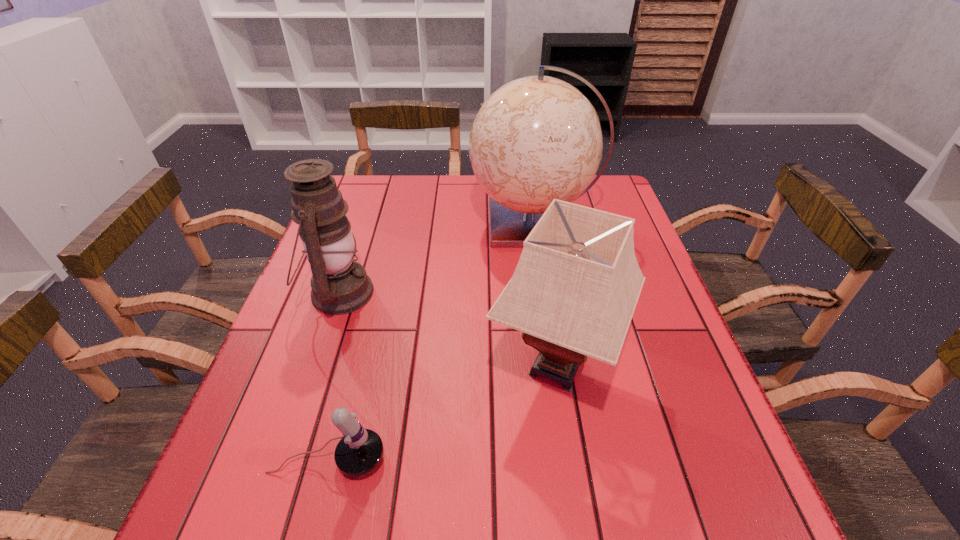
Image resolution: width=960 pixels, height=540 pixels. Identify the location of vacant region between the oil lamp and the tallest object. (436, 259).

Find the location of `object that is the third closest to the oil lamp`. object that is the third closest to the oil lamp is located at coordinates (573, 293).

Point out which object is positioned as the second nearest to the oil lamp. Please provide its 2D coordinates. Your answer should be formatted as a tuple, i.e. [(x, y)], where the tuple contains the x and y coordinates of a point satisfying the conditions above.

[(360, 450)]

You are a GUI agent. You are given a task and a screenshot of the screen. Output one action in this format:
    pyautogui.click(x=<x>, y=<y>)
    Task: Click on the free space that satisfies the following two spatial constraints: 1. on the surface of the tallest object showing Europe and Africa; 2. on the front side of the oil lamp
    
    Given the screenshot: What is the action you would take?
    pyautogui.click(x=543, y=293)

Where is `free location that satisfies the following two spatial constraints: 1. on the surface of the farthest object showing Europe and Africa; 2. on the back side of the lampshade`? The image size is (960, 540). free location that satisfies the following two spatial constraints: 1. on the surface of the farthest object showing Europe and Africa; 2. on the back side of the lampshade is located at coordinates (555, 367).

Identify the location of vacant point that satisfies the following two spatial constraints: 1. on the back side of the lampshade; 2. on the surface of the farthest object showing Europe and Africa. (534, 224).

Identify the location of free space in the image that satisfies the following two spatial constraints: 1. on the surface of the lampshade showing Europe and Africa; 2. on the right side of the tallest object. (555, 367).

Locate an element on the screen. vacant position in the image that satisfies the following two spatial constraints: 1. on the surface of the globe showing Europe and Africa; 2. on the back side of the lampshade is located at coordinates tap(555, 367).